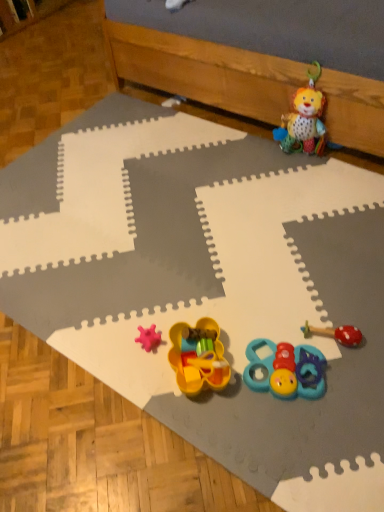
Locate an element on the screen. Image resolution: width=384 pixels, height=512 pixels. blank space to the left of red rubber teething ring at lower right, the 2th toy in the top-to-bottom sequence is located at coordinates (263, 327).